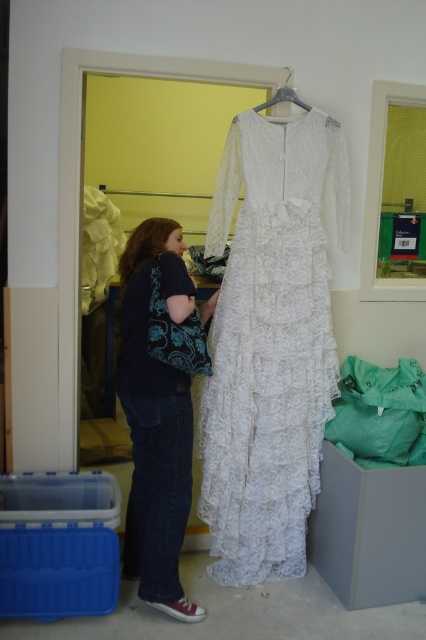
You are a fashion designer trying to arrange two garments in a photo shoot. You have the white lace dress at center and the black cotton shirt at left. Which garment should you place higher in the frame to ensure they are visually balanced?

To ensure visual balance, you should place the black cotton shirt at left higher in the frame because the white lace dress at center is taller, so elevating the shorter black cotton shirt at left will help balance their heights.

You are a fashion designer who wants to place a black cotton shirt at left and a white lace dress at center on a mannequin. The mannequin has a 12 inch wide base. Can both items fit side by side on the base without overlapping?

The white lace dress at center and black cotton shirt at left are 13.55 inches apart from each other. Since the mannequin base is only 12 inches wide, they cannot fit side by side without overlapping.

Looking at this image, you are a fashion designer trying to arrange two garments in a photo shoot. You have a white lace dress at center and a black cotton shirt at left. According to the scene, which garment is covering part of the other?

The white lace dress at center is positioned over the black cotton shirt at left, meaning it is covering part of the shirt.